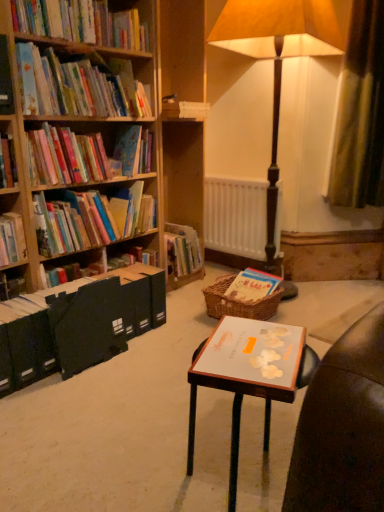
Find the location of a particular element. free location above brown woven picnic basket at center (from a real-world perspective) is located at coordinates (252, 281).